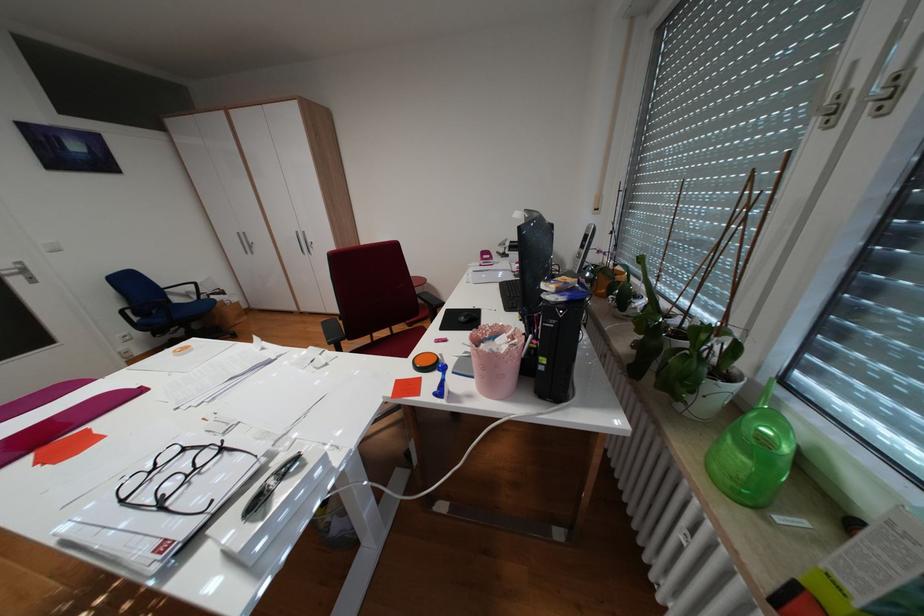
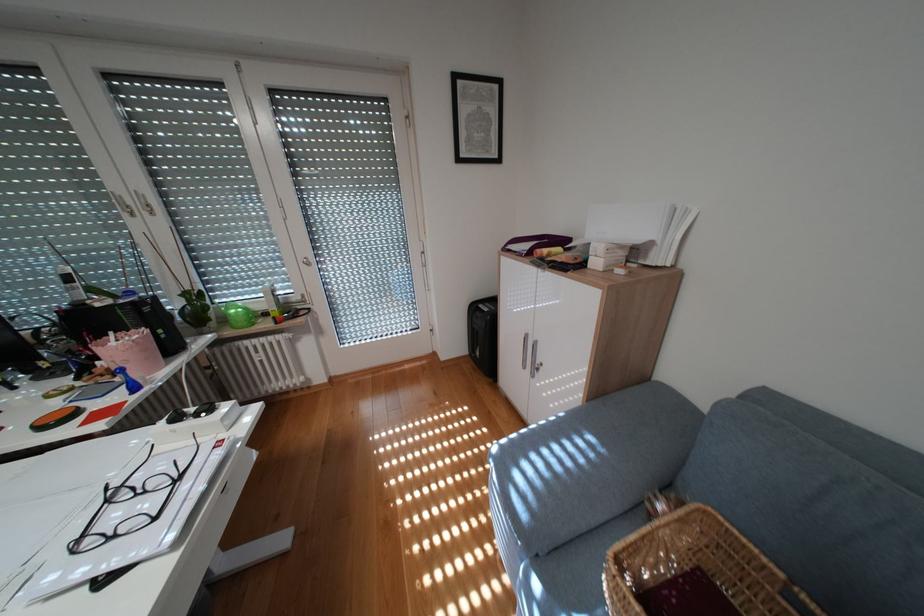
The point at (x=871, y=82) is marked in the first image. Where is the corresponding point in the second image?

(141, 201)